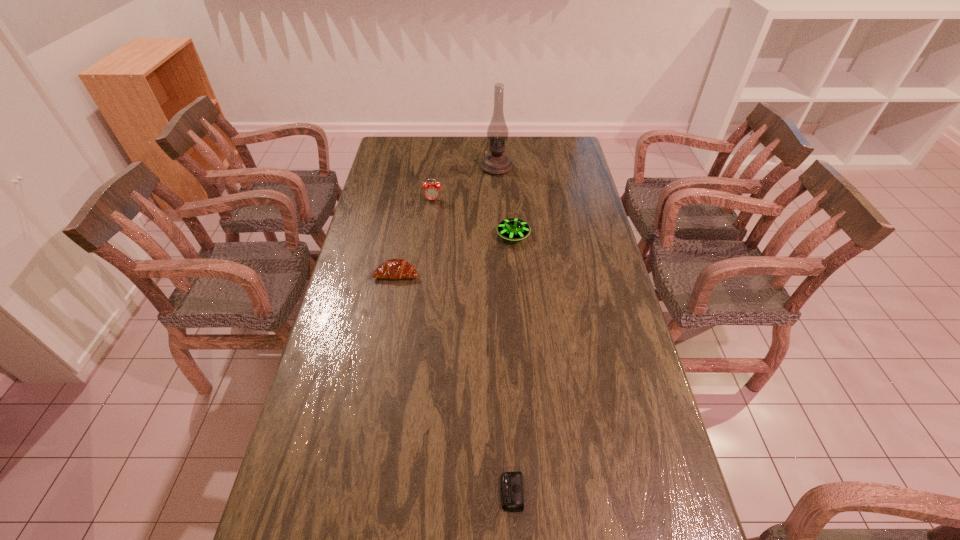
The height and width of the screenshot is (540, 960). Find the location of `the tallest object`. the tallest object is located at coordinates (495, 163).

At what (x,y) coordinates should I click in order to perform the action: click on oil lamp. Please return your answer as a coordinate pair (x, y). Looking at the image, I should click on (495, 163).

The height and width of the screenshot is (540, 960). Identify the location of the fourth shortest object. (432, 191).

Find the location of `the left alarm clock`. the left alarm clock is located at coordinates (432, 191).

The height and width of the screenshot is (540, 960). I want to click on saucer, so click(513, 229).

Locate an element on the screen. This screenshot has height=540, width=960. the third tallest object is located at coordinates (513, 229).

Image resolution: width=960 pixels, height=540 pixels. Find the location of `the second nearest object`. the second nearest object is located at coordinates (393, 268).

Where is `crescent roll`? crescent roll is located at coordinates (393, 268).

You are a GUI agent. You are given a task and a screenshot of the screen. Output one action in this format:
    pyautogui.click(x=<x>, y=<y>)
    Task: Click on the right alarm clock
    
    Given the screenshot: What is the action you would take?
    pyautogui.click(x=512, y=497)

The width and height of the screenshot is (960, 540). In order to click on the shortest object in this screenshot , I will do `click(512, 497)`.